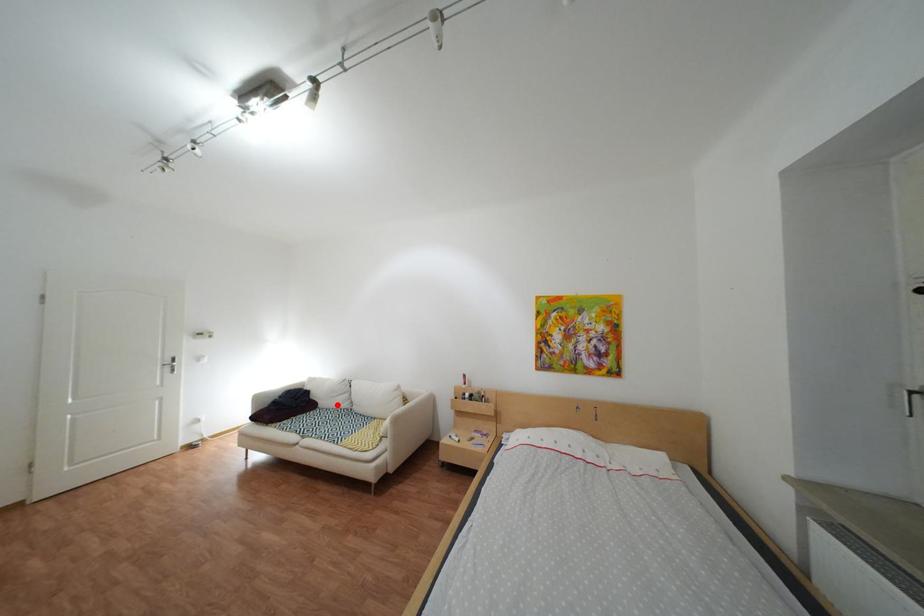
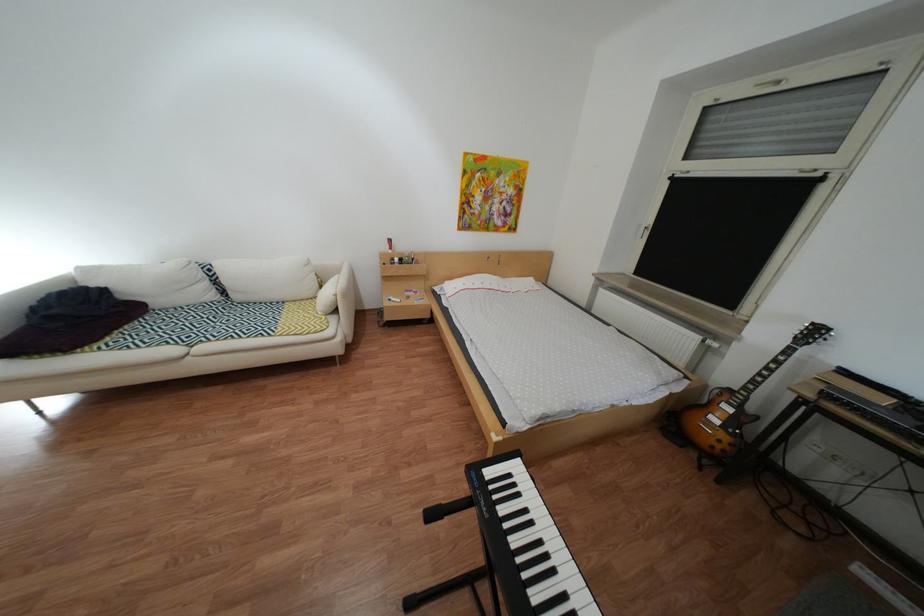
Find the pixel in the second image that matches the highlighted location in the first image.

(172, 304)